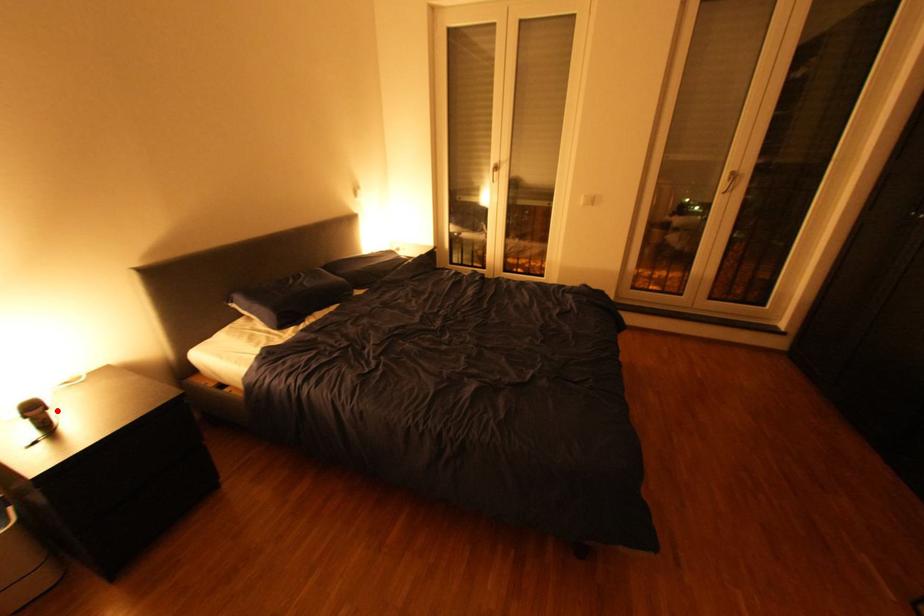
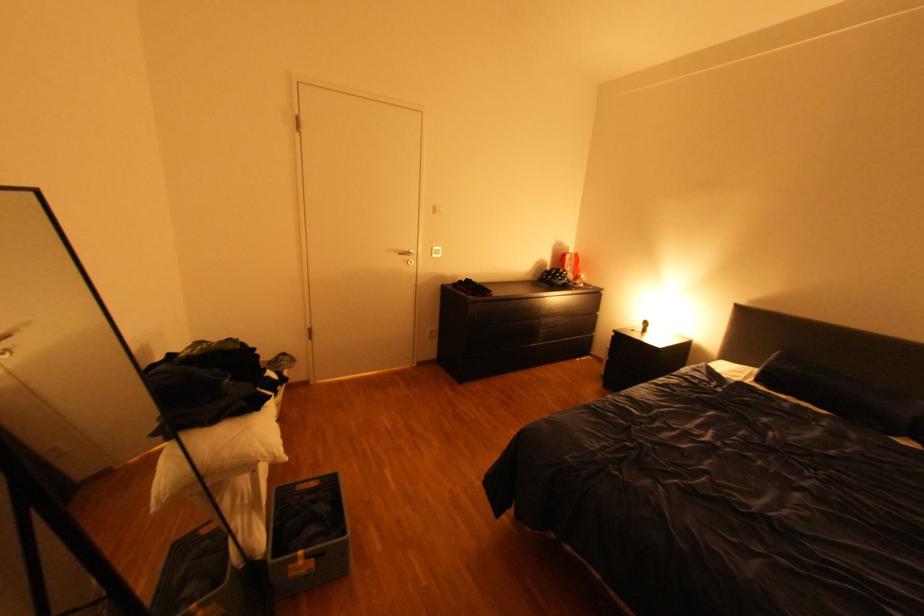
Question: I am providing you with two images of the same scene from different viewpoints. Given a red point in image1, look at the same physical point in image2. Is it:

Choices:
 (A) Closer to the viewpoint
 (B) Farther from the viewpoint

Answer: (B)